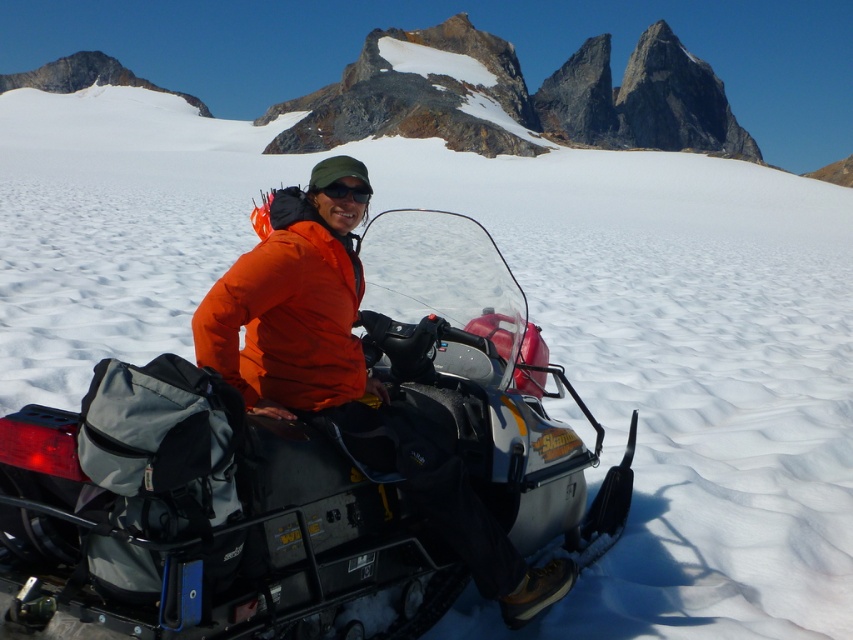
You are planning to take a photo of the matte black snowmobile at center and the black matte sunglasses at center. Based on their positions, which object should you focus on first if you want to capture both in a single shot without moving the camera?

The matte black snowmobile at center is located below the black matte sunglasses at center, so you should focus on the black matte sunglasses at center first to ensure both are in the frame.

You are a photographer standing at the point with coordinates point [212,538]. You want to take a photo of the snowmobile at center. Since you are already on the snowmobile, where exactly are you positioned on it?

The point [212,538] is located on the matte black snowmobile at center, so you are positioned on the snowmobile itself.

You are a photographer trying to capture the matte black snowmobile at center and the black matte sunglasses at center in the same frame. Based on their positions, which object is located to the left of the other?

The matte black snowmobile at center is positioned on the right side of black matte sunglasses at center, so the black matte sunglasses at center are to the left of the matte black snowmobile at center.